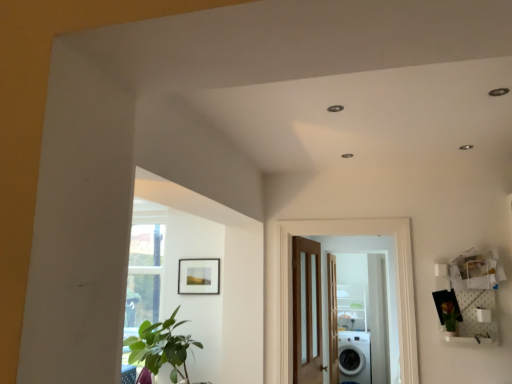
Question: Which direction should I rotate to look at wooden door with glass panels at center, which is the second door from back to front, — up or down?

Choices:
 (A) down
 (B) up

Answer: (A)

Question: Would you say white glossy washing machine at lower right is part of wooden door at center, marked as the first door in a back-to-front arrangement,'s contents?

Choices:
 (A) no
 (B) yes

Answer: (A)

Question: Is white glossy washing machine at lower right at the back of wooden door at center, the 3th door when ordered from front to back?

Choices:
 (A) yes
 (B) no

Answer: (B)

Question: Can you confirm if wooden door at center, marked as the first door in a back-to-front arrangement, is shorter than white glossy washing machine at lower right?

Choices:
 (A) yes
 (B) no

Answer: (B)

Question: Can you confirm if wooden door at center, marked as the first door in a back-to-front arrangement, is smaller than white glossy washing machine at lower right?

Choices:
 (A) yes
 (B) no

Answer: (A)

Question: Does wooden door at center, marked as the first door in a back-to-front arrangement, have a lesser width compared to white glossy washing machine at lower right?

Choices:
 (A) yes
 (B) no

Answer: (A)

Question: From the image's perspective, would you say wooden door at center, marked as the first door in a back-to-front arrangement, is positioned over white glossy washing machine at lower right?

Choices:
 (A) yes
 (B) no

Answer: (A)

Question: Is green leafy plant at right far away from green leafy plant at lower left?

Choices:
 (A) yes
 (B) no

Answer: (A)

Question: Considering the relative sizes of green leafy plant at right and green leafy plant at lower left in the image provided, is green leafy plant at right thinner than green leafy plant at lower left?

Choices:
 (A) no
 (B) yes

Answer: (B)

Question: Does green leafy plant at right have a lesser height compared to green leafy plant at lower left?

Choices:
 (A) yes
 (B) no

Answer: (A)

Question: Considering the relative sizes of green leafy plant at right and green leafy plant at lower left in the image provided, is green leafy plant at right wider than green leafy plant at lower left?

Choices:
 (A) yes
 (B) no

Answer: (B)

Question: From a real-world perspective, does green leafy plant at right sit lower than green leafy plant at lower left?

Choices:
 (A) yes
 (B) no

Answer: (B)

Question: Is green leafy plant at right turned away from green leafy plant at lower left?

Choices:
 (A) yes
 (B) no

Answer: (B)

Question: From a real-world perspective, is wooden door at center, the 3th door when ordered from front to back, physically above brown wooden door at center, the third door viewed from the back?

Choices:
 (A) yes
 (B) no

Answer: (B)